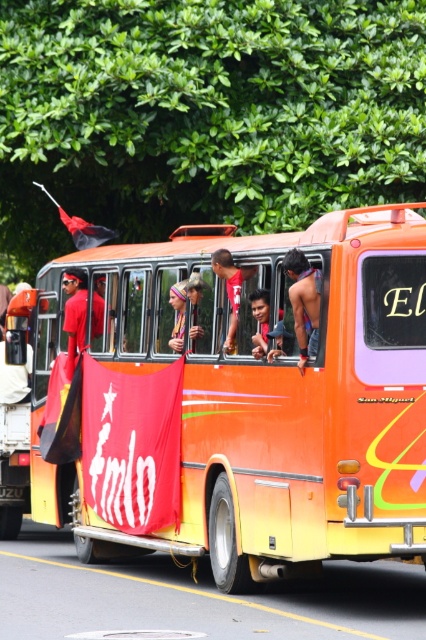
Question: Among these objects, which one is nearest to the camera?

Choices:
 (A) skinny man at center
 (B) matte red shirt at center
 (C) matte purple headscarf at center
 (D) orange matte bus at center

Answer: (D)

Question: Considering the real-world distances, which object is farthest from the matte red shirt at center?

Choices:
 (A) red fabric flag at left
 (B) orange matte bus at center
 (C) skinny man at center

Answer: (A)

Question: Does orange matte bus at center have a lesser width compared to skinny man at center?

Choices:
 (A) yes
 (B) no

Answer: (A)

Question: Does matte red shirt at center appear on the left side of matte purple headscarf at center?

Choices:
 (A) no
 (B) yes

Answer: (A)

Question: Estimate the real-world distances between objects in this image. Which object is farther from the skinny man at center?

Choices:
 (A) red fabric flag at left
 (B) orange matte bus at center

Answer: (A)

Question: Is skinny man at center positioned at the back of red fabric flag at left?

Choices:
 (A) yes
 (B) no

Answer: (B)